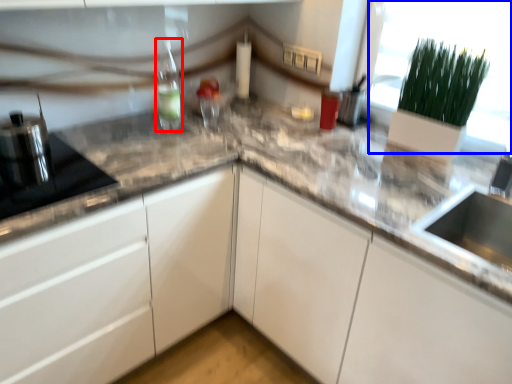
Question: Among these objects, which one is farthest to the camera, bottle (highlighted by a red box) or glass door (highlighted by a blue box)?

Choices:
 (A) bottle
 (B) glass door

Answer: (A)